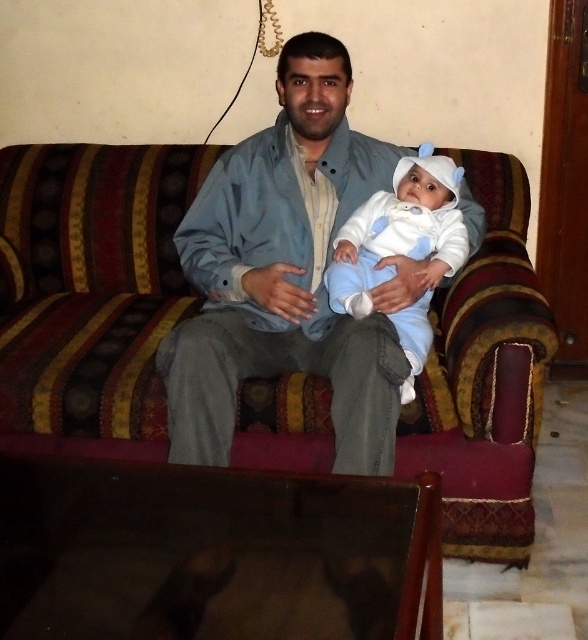
Is the position of striped fabric couch at center less distant than that of white soft baby at center?

Yes, it is in front of white soft baby at center.

Between striped fabric couch at center and white soft baby at center, which one is positioned lower?

striped fabric couch at center is lower down.

The height and width of the screenshot is (640, 588). Find the location of `striped fabric couch at center`. striped fabric couch at center is located at coordinates (91, 291).

Does striped fabric couch at center have a greater height compared to light blue fabric jacket at center?

Yes, striped fabric couch at center is taller than light blue fabric jacket at center.

Is striped fabric couch at center to the left of light blue fabric jacket at center from the viewer's perspective?

Yes, striped fabric couch at center is to the left of light blue fabric jacket at center.

Between point (98, 296) and point (345, 364), which one is positioned behind?

Point (98, 296)

Where is `striped fabric couch at center`? The width and height of the screenshot is (588, 640). striped fabric couch at center is located at coordinates (91, 291).

Between light blue fabric jacket at center and white soft baby at center, which one appears on the right side from the viewer's perspective?

Positioned to the right is white soft baby at center.

What do you see at coordinates (288, 273) in the screenshot?
I see `light blue fabric jacket at center` at bounding box center [288, 273].

Locate an element on the screen. This screenshot has width=588, height=640. light blue fabric jacket at center is located at coordinates (288, 273).